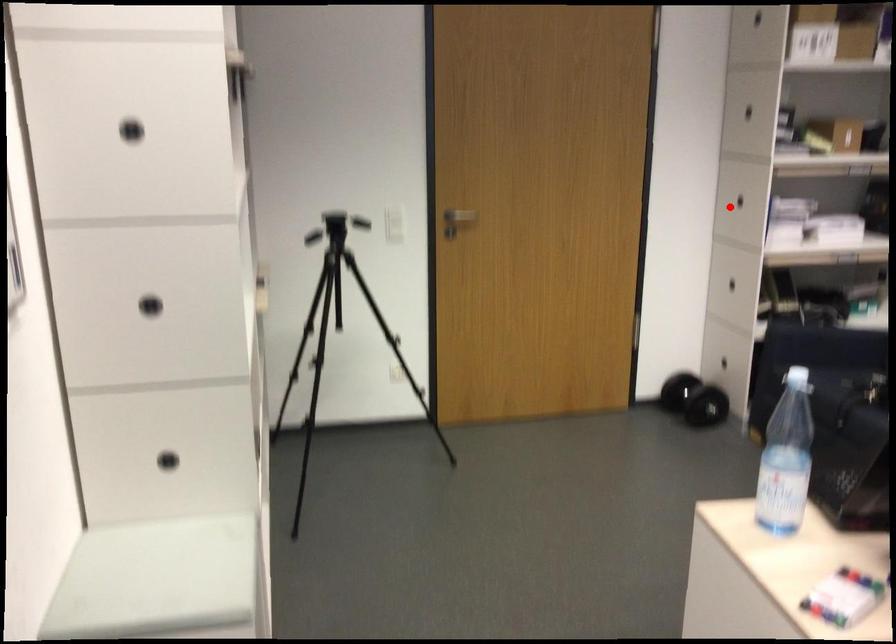
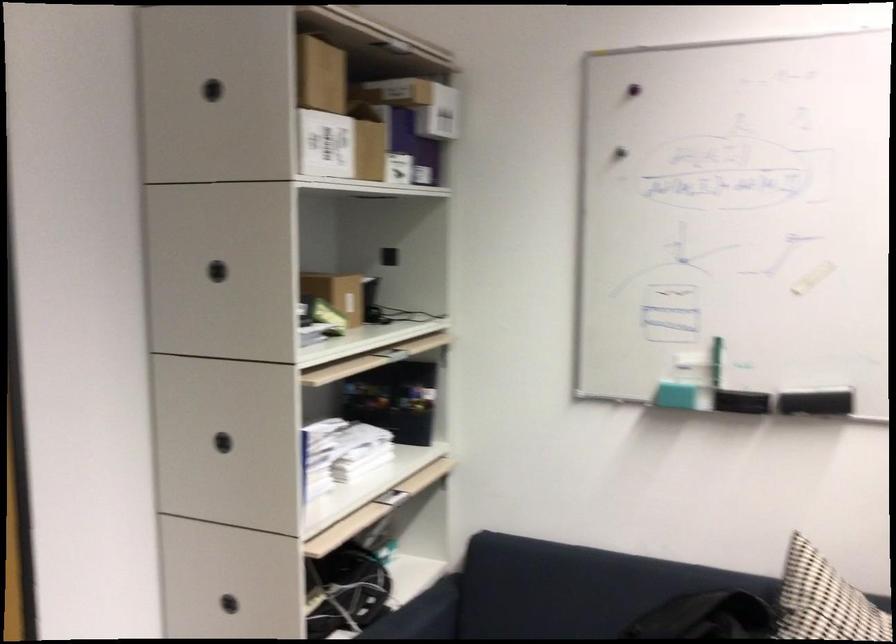
Question: A red point is marked in image1. In image2, is the corresponding 3D point closer to the camera or farther? Reply with the corresponding letter.

Choices:
 (A) The corresponding 3D point is closer.
 (B) The corresponding 3D point is farther.

Answer: (A)